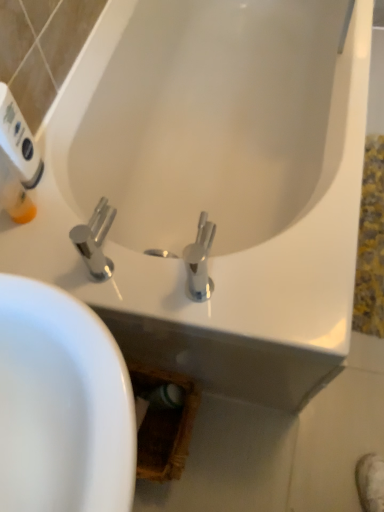
Where is `polished chrome faucet at center`? This screenshot has width=384, height=512. polished chrome faucet at center is located at coordinates (95, 240).

This screenshot has height=512, width=384. What do you see at coordinates (95, 240) in the screenshot?
I see `polished chrome faucet at center` at bounding box center [95, 240].

Describe the element at coordinates (18, 141) in the screenshot. I see `white plastic hand dryer at upper left` at that location.

In order to face white plastic hand dryer at upper left, should I rotate leftwards or rightwards?

To align with it, rotate left about 21.779°.

Where is `white plastic hand dryer at upper left`? The height and width of the screenshot is (512, 384). white plastic hand dryer at upper left is located at coordinates (18, 141).

Measure the distance between white plastic hand dryer at upper left and camera.

white plastic hand dryer at upper left is 27.40 inches from camera.

Identify the location of polished chrome faucet at center. (95, 240).

Would you say polished chrome faucet at center is to the left or to the right of white plastic hand dryer at upper left in the picture?

Based on their positions, polished chrome faucet at center is located to the right of white plastic hand dryer at upper left.

Considering the positions of objects polished chrome faucet at center and white plastic hand dryer at upper left in the image provided, who is behind, polished chrome faucet at center or white plastic hand dryer at upper left?

white plastic hand dryer at upper left is more distant.

Which is more distant, (86, 231) or (6, 119)?

The point (6, 119) is more distant.

From the image's perspective, is polished chrome faucet at center beneath white plastic hand dryer at upper left?

Yes.

From a real-world perspective, is polished chrome faucet at center positioned above or below white plastic hand dryer at upper left?

polished chrome faucet at center is situated lower than white plastic hand dryer at upper left in the real world.

Which of these two, polished chrome faucet at center or white plastic hand dryer at upper left, is thinner?

white plastic hand dryer at upper left.

Which of these two, polished chrome faucet at center or white plastic hand dryer at upper left, stands taller?

With more height is white plastic hand dryer at upper left.

Consider the image. Considering the sizes of polished chrome faucet at center and white plastic hand dryer at upper left in the image, is polished chrome faucet at center bigger or smaller than white plastic hand dryer at upper left?

Clearly, polished chrome faucet at center is larger in size than white plastic hand dryer at upper left.

Is polished chrome faucet at center positioned beyond the bounds of white plastic hand dryer at upper left?

Yes, polished chrome faucet at center is outside of white plastic hand dryer at upper left.

Is there a large distance between polished chrome faucet at center and white plastic hand dryer at upper left?

That's not correct — polished chrome faucet at center is a little close to white plastic hand dryer at upper left.

Could you tell me if polished chrome faucet at center is facing white plastic hand dryer at upper left?

No, polished chrome faucet at center is not oriented towards white plastic hand dryer at upper left.

How far apart are polished chrome faucet at center and white plastic hand dryer at upper left?

They are 7.50 inches apart.

The height and width of the screenshot is (512, 384). What are the coordinates of `tap below the white plastic hand dryer at upper left (from a real-world perspective)` in the screenshot? It's located at pyautogui.click(x=95, y=240).

Does white plastic hand dryer at upper left appear on the right side of polished chrome faucet at center?

In fact, white plastic hand dryer at upper left is to the left of polished chrome faucet at center.

Considering their positions, is white plastic hand dryer at upper left located in front of or behind polished chrome faucet at center?

In the image, white plastic hand dryer at upper left appears behind polished chrome faucet at center.

Is point (4, 94) in front of point (94, 259)?

Yes, it is in front of point (94, 259).

From the image's perspective, which object appears higher, white plastic hand dryer at upper left or polished chrome faucet at center?

white plastic hand dryer at upper left.

From a real-world perspective, which is physically above, white plastic hand dryer at upper left or polished chrome faucet at center?

From a 3D spatial view, white plastic hand dryer at upper left is above.

Looking at their sizes, would you say white plastic hand dryer at upper left is wider or thinner than polished chrome faucet at center?

Clearly, white plastic hand dryer at upper left has less width compared to polished chrome faucet at center.

Does white plastic hand dryer at upper left have a lesser height compared to polished chrome faucet at center?

No.

Considering the sizes of objects white plastic hand dryer at upper left and polished chrome faucet at center in the image provided, who is smaller, white plastic hand dryer at upper left or polished chrome faucet at center?

Smaller between the two is white plastic hand dryer at upper left.

Can we say white plastic hand dryer at upper left lies outside polished chrome faucet at center?

Absolutely, white plastic hand dryer at upper left is external to polished chrome faucet at center.

Are white plastic hand dryer at upper left and polished chrome faucet at center located far from each other?

No, there isn't a large distance between white plastic hand dryer at upper left and polished chrome faucet at center.

Does white plastic hand dryer at upper left turn towards polished chrome faucet at center?

No, white plastic hand dryer at upper left is not aimed at polished chrome faucet at center.

How different are the orientations of white plastic hand dryer at upper left and polished chrome faucet at center in degrees?

The angular difference between white plastic hand dryer at upper left and polished chrome faucet at center is 90 degrees.

Identify the location of hand dryer lying on the left of polished chrome faucet at center. (18, 141).

The height and width of the screenshot is (512, 384). Identify the location of tap lying below the white plastic hand dryer at upper left (from the image's perspective). (95, 240).

Find the location of a particular element. The width and height of the screenshot is (384, 512). hand dryer on the left of the polished chrome faucet at center is located at coordinates (18, 141).